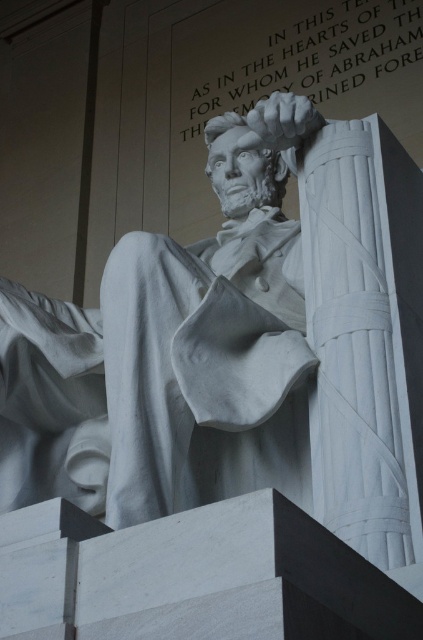
Question: Can you confirm if white marble robe at center is positioned to the right of white marble text at upper center?

Choices:
 (A) no
 (B) yes

Answer: (A)

Question: Can you confirm if white marble column at right is wider than white marble text at upper center?

Choices:
 (A) no
 (B) yes

Answer: (A)

Question: Is white marble robe at center bigger than white marble column at right?

Choices:
 (A) yes
 (B) no

Answer: (A)

Question: Which point is closer to the camera?

Choices:
 (A) [332, 458]
 (B) [151, 272]

Answer: (A)

Question: Which object is the closest to the white marble text at upper center?

Choices:
 (A) white marble robe at center
 (B) white marble column at right

Answer: (A)

Question: Considering the real-world distances, which object is farthest from the white marble robe at center?

Choices:
 (A) white marble text at upper center
 (B) white marble column at right

Answer: (A)